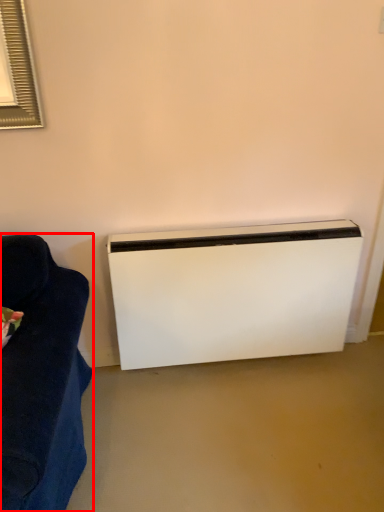
Question: Observing the image, what is the correct spatial positioning of furniture (annotated by the red box) in reference to home appliance?

Choices:
 (A) right
 (B) left

Answer: (B)